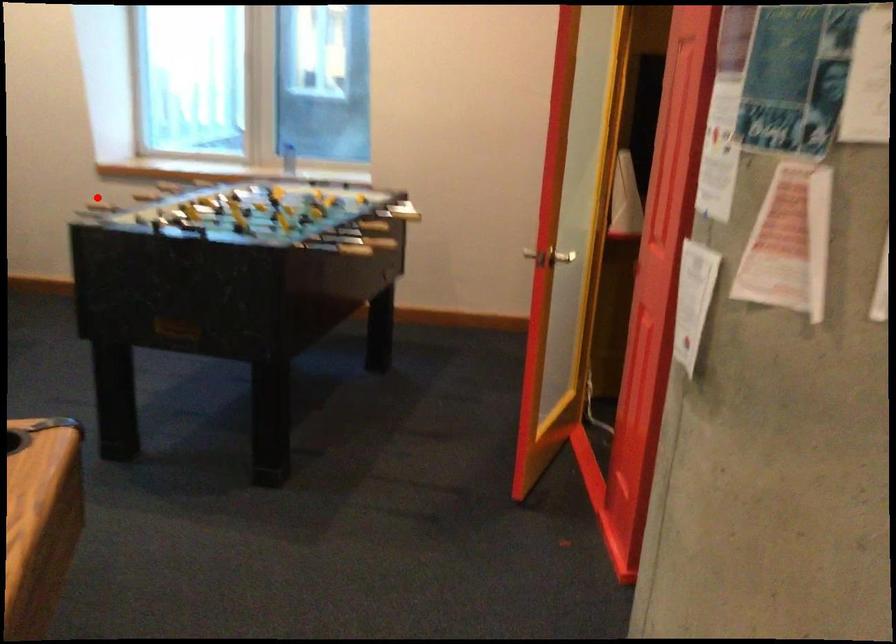
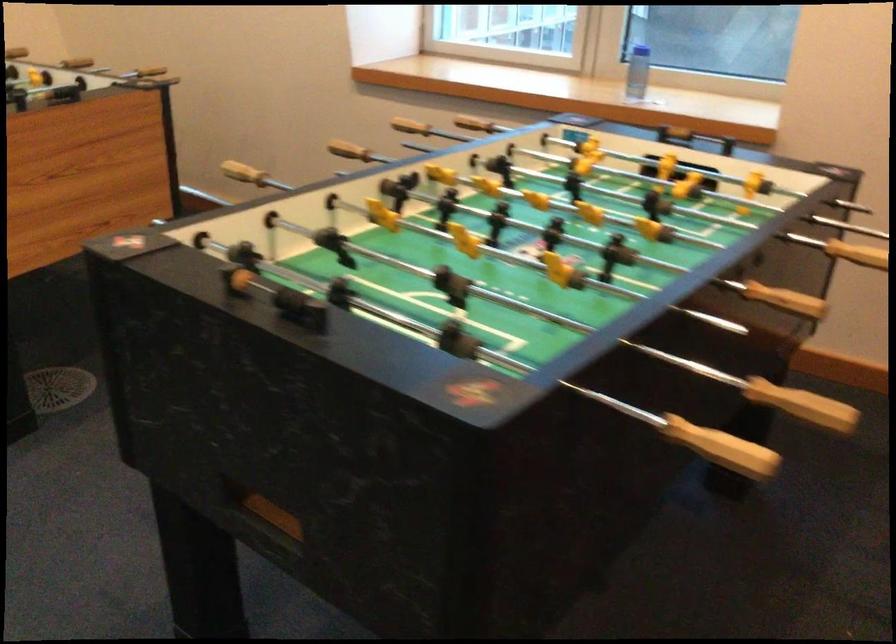
Where in the second image is the point corresponding to the highlighted location from the first image?

(243, 172)